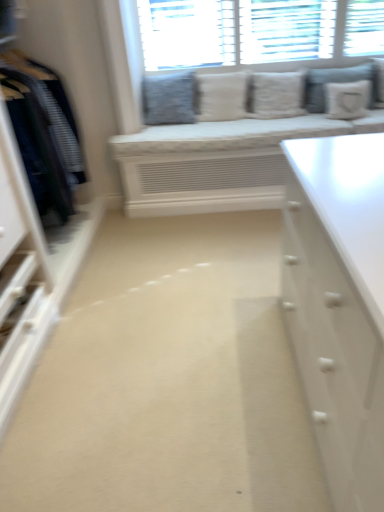
The width and height of the screenshot is (384, 512). Describe the element at coordinates (187, 33) in the screenshot. I see `white textured pillows at upper center` at that location.

You are a GUI agent. You are given a task and a screenshot of the screen. Output one action in this format:
    pyautogui.click(x=<x>, y=<y>)
    Task: Click on the gray fabric pillow at upper right, which is the second pillow in right-to-left order
    The width and height of the screenshot is (384, 512).
    Given the screenshot: What is the action you would take?
    pyautogui.click(x=331, y=82)

From the picture: In the image, is white textured pillows at upper center on the left side or the right side of textured gray pillow at upper center, arranged as the fifth pillow when viewed from the right?

In the image, white textured pillows at upper center appears on the right side of textured gray pillow at upper center, arranged as the fifth pillow when viewed from the right.

Which is closer to the camera, [355,26] or [176,99]?

The point [355,26] is in front.

Could textured gray pillow at upper center, the first pillow when ordered from left to right, be considered to be inside white textured pillows at upper center?

Actually, textured gray pillow at upper center, the first pillow when ordered from left to right, is outside white textured pillows at upper center.

Is white textured pillows at upper center turned away from textured gray pillow at upper center, arranged as the fifth pillow when viewed from the right?

white textured pillows at upper center is not turned away from textured gray pillow at upper center, arranged as the fifth pillow when viewed from the right.

In the scene shown: Does textured gray pillow at upper center, arranged as the fifth pillow when viewed from the right, have a lesser height compared to white textured pillow at center, which ranks as the third pillow in left-to-right order?

Yes, textured gray pillow at upper center, arranged as the fifth pillow when viewed from the right, is shorter than white textured pillow at center, which ranks as the third pillow in left-to-right order.

This screenshot has width=384, height=512. There is a white textured pillow at center, which ranks as the third pillow in left-to-right order. Identify the location of pillow above it (from a real-world perspective). (169, 99).

Which object is thinner, textured gray pillow at upper center, the first pillow when ordered from left to right, or white textured pillow at center, which ranks as the third pillow in left-to-right order?

With smaller width is white textured pillow at center, which ranks as the third pillow in left-to-right order.

How far apart are textured gray pillow at upper center, the first pillow when ordered from left to right, and white textured pillow at center, which ranks as the third pillow in left-to-right order?

textured gray pillow at upper center, the first pillow when ordered from left to right, and white textured pillow at center, which ranks as the third pillow in left-to-right order, are 21.86 inches apart from each other.

Is textured gray pillow at upper center, the first pillow when ordered from left to right, next to white textured pillows at upper center and touching it?

No, textured gray pillow at upper center, the first pillow when ordered from left to right, is not with white textured pillows at upper center.

Who is smaller, textured gray pillow at upper center, arranged as the fifth pillow when viewed from the right, or white textured pillows at upper center?

With smaller size is textured gray pillow at upper center, arranged as the fifth pillow when viewed from the right.

Which object is thinner, textured gray pillow at upper center, the first pillow when ordered from left to right, or white textured pillows at upper center?

white textured pillows at upper center.

Is textured gray pillow at upper center, arranged as the fifth pillow when viewed from the right, facing towards white textured pillows at upper center?

No, textured gray pillow at upper center, arranged as the fifth pillow when viewed from the right, is not oriented towards white textured pillows at upper center.

Is beige carpet at center spatially inside gray fabric pillow at upper right, which appears as the 4th pillow when viewed from the left, or outside of it?

beige carpet at center is spatially situated outside gray fabric pillow at upper right, which appears as the 4th pillow when viewed from the left.

Visually, is beige carpet at center positioned to the left or to the right of gray fabric pillow at upper right, which is the second pillow in right-to-left order?

beige carpet at center is to the left of gray fabric pillow at upper right, which is the second pillow in right-to-left order.

How many degrees apart are the facing directions of beige carpet at center and gray fabric pillow at upper right, which is the second pillow in right-to-left order?

The angular difference between beige carpet at center and gray fabric pillow at upper right, which is the second pillow in right-to-left order, is 2.24 degrees.

How distant is beige carpet at center from gray fabric pillow at upper right, which is the second pillow in right-to-left order?

1.80 meters.

From a real-world perspective, is white textured pillows at upper center located beneath white textured pillow at center, the second pillow from the left?

No, from a real-world perspective, white textured pillows at upper center is not below white textured pillow at center, the second pillow from the left.

Which of these two, white textured pillows at upper center or white textured pillow at center, which is counted as the 4th pillow, starting from the right, is smaller?

white textured pillow at center, which is counted as the 4th pillow, starting from the right.

Considering the sizes of white textured pillows at upper center and white textured pillow at center, the second pillow from the left, in the image, is white textured pillows at upper center wider or thinner than white textured pillow at center, the second pillow from the left,?

white textured pillows at upper center is thinner than white textured pillow at center, the second pillow from the left.

Which object is positioned more to the right, white textured pillows at upper center or white textured pillow at center, the second pillow from the left?

white textured pillows at upper center.

Is gray fabric pillow at upper right, which is the second pillow in right-to-left order, positioned in front of textured gray pillow at upper center, the first pillow when ordered from left to right?

No, the depth of gray fabric pillow at upper right, which is the second pillow in right-to-left order, is greater than that of textured gray pillow at upper center, the first pillow when ordered from left to right.

Could you tell me if gray fabric pillow at upper right, which is the second pillow in right-to-left order, is turned towards textured gray pillow at upper center, the first pillow when ordered from left to right?

No, gray fabric pillow at upper right, which is the second pillow in right-to-left order, does not turn towards textured gray pillow at upper center, the first pillow when ordered from left to right.

Based on their sizes in the image, would you say gray fabric pillow at upper right, which appears as the 4th pillow when viewed from the left, is bigger or smaller than textured gray pillow at upper center, arranged as the fifth pillow when viewed from the right?

Clearly, gray fabric pillow at upper right, which appears as the 4th pillow when viewed from the left, is smaller in size than textured gray pillow at upper center, arranged as the fifth pillow when viewed from the right.

Is gray fabric pillow at upper right, which is the second pillow in right-to-left order, facing away from white fabric pillow at upper right, the fifth pillow when ordered from left to right?

Yes, gray fabric pillow at upper right, which is the second pillow in right-to-left order, is facing away from white fabric pillow at upper right, the fifth pillow when ordered from left to right.

Is gray fabric pillow at upper right, which appears as the 4th pillow when viewed from the left, inside or outside of white fabric pillow at upper right, the fifth pillow when ordered from left to right?

gray fabric pillow at upper right, which appears as the 4th pillow when viewed from the left, lies outside white fabric pillow at upper right, the fifth pillow when ordered from left to right.

How different are the orientations of gray fabric pillow at upper right, which is the second pillow in right-to-left order, and white fabric pillow at upper right, the fifth pillow when ordered from left to right, in degrees?

There is a 0.377-degree angle between the facing directions of gray fabric pillow at upper right, which is the second pillow in right-to-left order, and white fabric pillow at upper right, the fifth pillow when ordered from left to right.

Can you confirm if gray fabric pillow at upper right, which appears as the 4th pillow when viewed from the left, is bigger than white fabric pillow at upper right, placed as the first pillow when sorted from right to left?

Yes, gray fabric pillow at upper right, which appears as the 4th pillow when viewed from the left, is bigger than white fabric pillow at upper right, placed as the first pillow when sorted from right to left.

You are a GUI agent. You are given a task and a screenshot of the screen. Output one action in this format:
    pyautogui.click(x=<x>, y=<y>)
    Task: Click on the window on the right side of textured gray pillow at upper center, arranged as the fifth pillow when viewed from the right
    The image size is (384, 512).
    Given the screenshot: What is the action you would take?
    pyautogui.click(x=187, y=33)

Which pillow is the 1st one when counting from the front of the textured gray pillow at upper center, arranged as the fifth pillow when viewed from the right? Please provide its 2D coordinates.

[(276, 95)]

Which object lies nearer to the anchor point white textured pillows at upper center, white textured pillow at center, which is counted as the 4th pillow, starting from the right, or gray fabric pillow at upper right, which is the second pillow in right-to-left order?

white textured pillow at center, which is counted as the 4th pillow, starting from the right.

Looking at the image, which one is located further to white textured pillow at center, the second pillow from the left, white textured pillow at center, acting as the 3th pillow starting from the right, or textured gray pillow at upper center, arranged as the fifth pillow when viewed from the right?

textured gray pillow at upper center, arranged as the fifth pillow when viewed from the right.

When comparing their distances from beige carpet at center, does white textured pillows at upper center or white textured pillow at center, acting as the 3th pillow starting from the right, seem further?

Based on the image, white textured pillows at upper center appears to be further to beige carpet at center.

Considering their positions, is white textured pillows at upper center positioned closer to gray fabric pillow at upper right, which appears as the 4th pillow when viewed from the left, than textured gray pillow at upper center, arranged as the fifth pillow when viewed from the right?

white textured pillows at upper center is closer to gray fabric pillow at upper right, which appears as the 4th pillow when viewed from the left.

When comparing their distances from dark blue fabric at left, does white textured pillows at upper center or beige carpet at center seem closer?

The object closer to dark blue fabric at left is beige carpet at center.

Considering their positions, is white textured pillow at center, which ranks as the third pillow in left-to-right order, positioned further to white textured pillows at upper center than white fabric pillow at upper right, placed as the first pillow when sorted from right to left?

white fabric pillow at upper right, placed as the first pillow when sorted from right to left, lies further to white textured pillows at upper center than the other object.

When comparing their distances from white textured pillows at upper center, does textured gray pillow at upper center, arranged as the fifth pillow when viewed from the right, or white textured pillow at center, which is counted as the 4th pillow, starting from the right, seem closer?

white textured pillow at center, which is counted as the 4th pillow, starting from the right, is positioned closer to the anchor white textured pillows at upper center.

Considering their positions, is gray fabric pillow at upper right, which is the second pillow in right-to-left order, positioned further to dark blue fabric at left than white fabric pillow at upper right, the fifth pillow when ordered from left to right?

white fabric pillow at upper right, the fifth pillow when ordered from left to right, is positioned further to the anchor dark blue fabric at left.

I want to click on window situated between dark blue fabric at left and gray fabric pillow at upper right, which is the second pillow in right-to-left order, from left to right, so click(x=187, y=33).

Locate an element on the screen. pillow between white textured pillow at center, the second pillow from the left, and gray fabric pillow at upper right, which is the second pillow in right-to-left order is located at coordinates (276, 95).

Find the location of a particular element. The width and height of the screenshot is (384, 512). clothing positioned between beige carpet at center and white textured pillow at center, which is counted as the 4th pillow, starting from the right, from near to far is located at coordinates (43, 133).

Image resolution: width=384 pixels, height=512 pixels. Find the location of `clothing between white textured pillows at upper center and beige carpet at center in the up-down direction`. clothing between white textured pillows at upper center and beige carpet at center in the up-down direction is located at coordinates (43, 133).